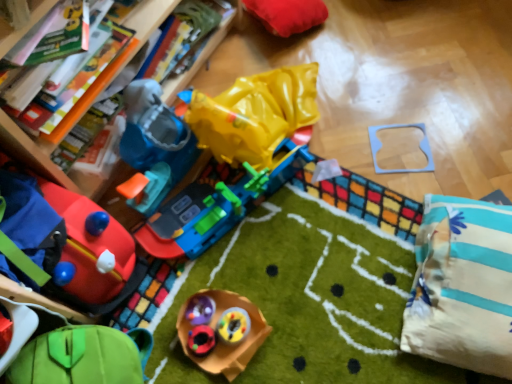
Question: Is white striped pillow at lower right at the right side of rubberized plastic toy at center, the fourth toy in the top-to-bottom sequence?

Choices:
 (A) no
 (B) yes

Answer: (B)

Question: From the image's perspective, is white striped pillow at lower right beneath rubberized plastic toy at center, the fourth toy in the top-to-bottom sequence?

Choices:
 (A) no
 (B) yes

Answer: (A)

Question: Would you say white striped pillow at lower right contains rubberized plastic toy at center, the fourth toy in the bottom-to-top sequence?

Choices:
 (A) no
 (B) yes

Answer: (A)

Question: From the image's perspective, is white striped pillow at lower right on top of rubberized plastic toy at center, the fourth toy in the bottom-to-top sequence?

Choices:
 (A) yes
 (B) no

Answer: (A)

Question: Is white striped pillow at lower right thinner than rubberized plastic toy at center, the fourth toy in the bottom-to-top sequence?

Choices:
 (A) yes
 (B) no

Answer: (B)

Question: In the image, is rubberized plastic toy at center, which is the third toy from bottom to top, on the left side or the right side of rubberized plastic toy at center, the fourth toy in the top-to-bottom sequence?

Choices:
 (A) left
 (B) right

Answer: (B)

Question: From the image's perspective, is rubberized plastic toy at center, which is the third toy from bottom to top, above or below rubberized plastic toy at center, the fourth toy in the top-to-bottom sequence?

Choices:
 (A) below
 (B) above

Answer: (A)

Question: Looking at their shapes, would you say rubberized plastic toy at center, which is the third toy from bottom to top, is wider or thinner than rubberized plastic toy at center, the fourth toy in the bottom-to-top sequence?

Choices:
 (A) wide
 (B) thin

Answer: (B)

Question: Considering the positions of rubberized plastic toy at center, which is the third toy from bottom to top, and rubberized plastic toy at center, the fourth toy in the bottom-to-top sequence, in the image, is rubberized plastic toy at center, which is the third toy from bottom to top, bigger or smaller than rubberized plastic toy at center, the fourth toy in the bottom-to-top sequence,?

Choices:
 (A) small
 (B) big

Answer: (A)

Question: Choose the correct answer: Is rubberized plastic toy at center, the fourth toy in the bottom-to-top sequence, inside rubberized red car at lower left, the fifth toy from the bottom, or outside it?

Choices:
 (A) outside
 (B) inside

Answer: (A)

Question: In the image, is rubberized plastic toy at center, the fourth toy in the top-to-bottom sequence, on the left side or the right side of rubberized red car at lower left, arranged as the third toy when viewed from the top?

Choices:
 (A) left
 (B) right

Answer: (B)

Question: From a real-world perspective, is rubberized plastic toy at center, the fourth toy in the top-to-bottom sequence, physically located above or below rubberized red car at lower left, arranged as the third toy when viewed from the top?

Choices:
 (A) above
 (B) below

Answer: (B)

Question: From the image's perspective, is rubberized plastic toy at center, the fourth toy in the bottom-to-top sequence, above or below rubberized red car at lower left, the fifth toy from the bottom?

Choices:
 (A) below
 (B) above

Answer: (A)

Question: In the image, is wooden puzzle piece at upper center, the 6th toy when ordered from bottom to top, on the left side or the right side of white striped pillow at lower right?

Choices:
 (A) right
 (B) left

Answer: (B)

Question: Is wooden puzzle piece at upper center, the 6th toy when ordered from bottom to top, in front of or behind white striped pillow at lower right in the image?

Choices:
 (A) behind
 (B) front

Answer: (A)